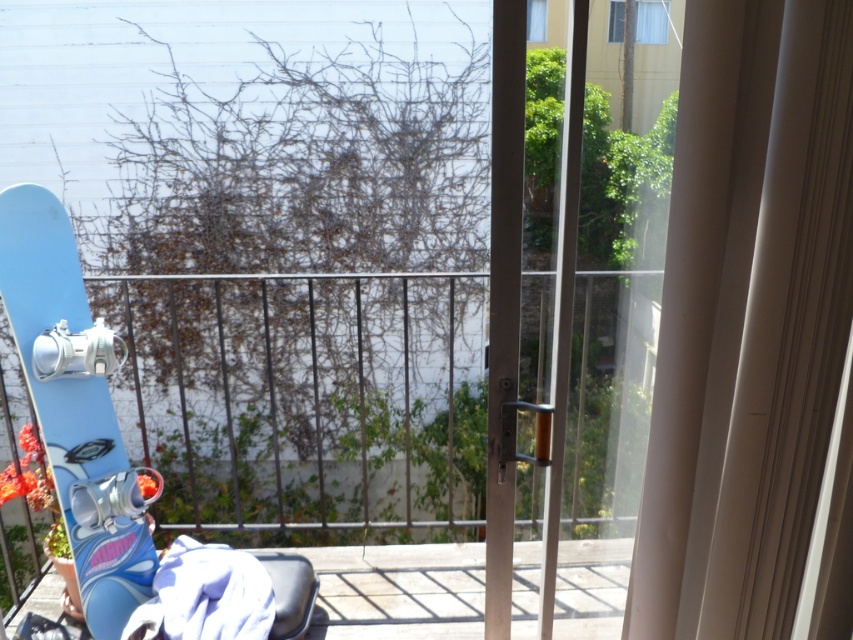
Can you confirm if transparent glass door at center is taller than light blue matte snowboard at left?

Yes.

Which is more to the left, transparent glass door at center or light blue matte snowboard at left?

light blue matte snowboard at left

The image size is (853, 640). Find the location of `transparent glass door at center`. transparent glass door at center is located at coordinates (563, 298).

Does blue glossy snowboard at left appear over light blue matte snowboard at left?

Yes.

Who is lower down, blue glossy snowboard at left or light blue matte snowboard at left?

light blue matte snowboard at left is below.

Consider the image. Who is more distant from viewer, (262, 464) or (67, 275)?

Point (262, 464)

At what (x,y) coordinates should I click in order to perform the action: click on blue glossy snowboard at left. Please return your answer as a coordinate pair (x, y). Looking at the image, I should click on (305, 397).

Between blue glossy snowboard at left and transparent glass door at center, which one appears on the left side from the viewer's perspective?

blue glossy snowboard at left is more to the left.

Does blue glossy snowboard at left have a lesser height compared to transparent glass door at center?

Correct, blue glossy snowboard at left is not as tall as transparent glass door at center.

Describe the element at coordinates (305, 397) in the screenshot. I see `blue glossy snowboard at left` at that location.

Identify the location of blue glossy snowboard at left. (305, 397).